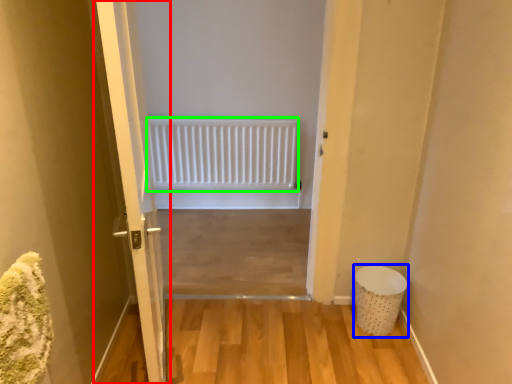
Question: Based on their relative distances, which object is farther from door (highlighted by a red box)? Choose from laundry basket (highlighted by a blue box) and radiator (highlighted by a green box).

Choices:
 (A) laundry basket
 (B) radiator

Answer: (B)